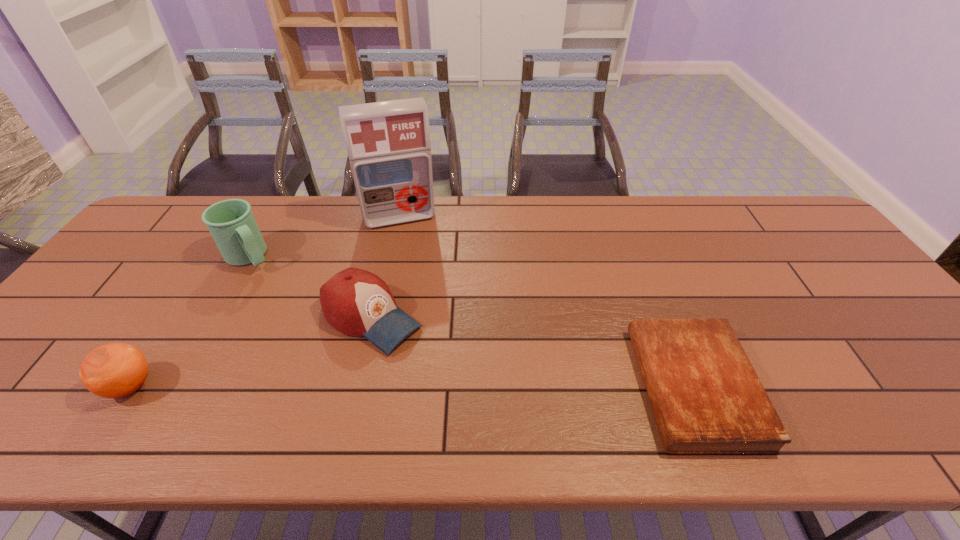
Image resolution: width=960 pixels, height=540 pixels. I want to click on free spot located on the spine side of the Bible, so click(503, 387).

This screenshot has width=960, height=540. I want to click on vacant space located 0.190m on the spine side of the Bible, so click(557, 387).

Identify the location of blank area located 0.050m on the side of the fourth nearest object with the handle. pos(271,279).

In order to click on vacant space located on the side of the fourth nearest object with the handle in this screenshot , I will do `click(297, 305)`.

At what (x,y) coordinates should I click in order to perform the action: click on blank space located on the side of the fourth nearest object with the handle. Please return your answer as a coordinate pair (x, y). This screenshot has height=540, width=960. Looking at the image, I should click on (x=281, y=289).

Locate an element on the screen. Image resolution: width=960 pixels, height=540 pixels. free space located on the front-facing side of the baseball cap is located at coordinates (477, 388).

The width and height of the screenshot is (960, 540). Find the location of `vacant space located on the front-facing side of the baseball cap`. vacant space located on the front-facing side of the baseball cap is located at coordinates (453, 372).

Image resolution: width=960 pixels, height=540 pixels. Identify the location of free location located on the front-facing side of the baseball cap. (463, 379).

You are a GUI agent. You are given a task and a screenshot of the screen. Output one action in this format:
    pyautogui.click(x=<x>, y=<y>)
    Task: Click on the blank space located on the front-facing side of the farthest object
    
    Given the screenshot: What is the action you would take?
    pyautogui.click(x=420, y=275)

Locate an element on the screen. The width and height of the screenshot is (960, 540). free space located on the front-facing side of the farthest object is located at coordinates (414, 253).